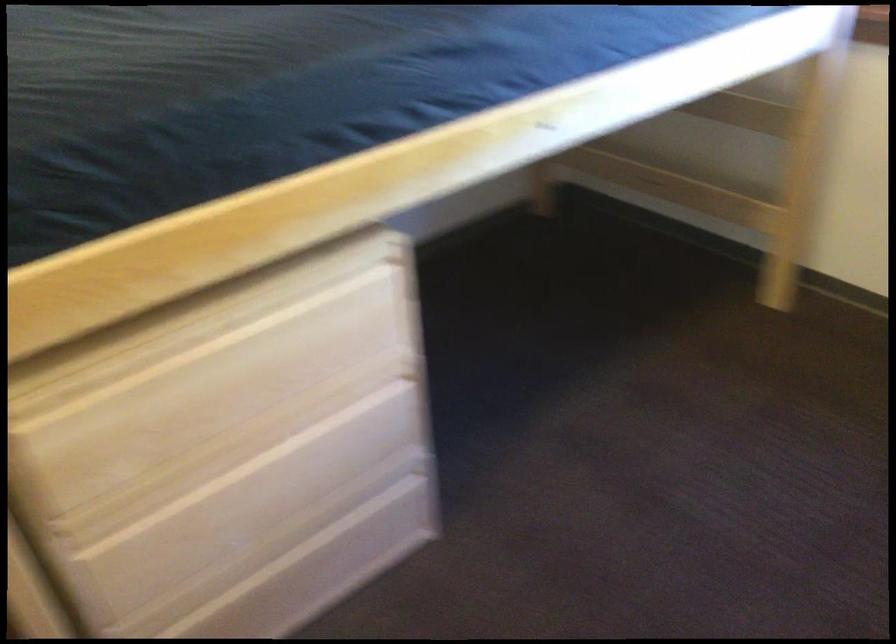
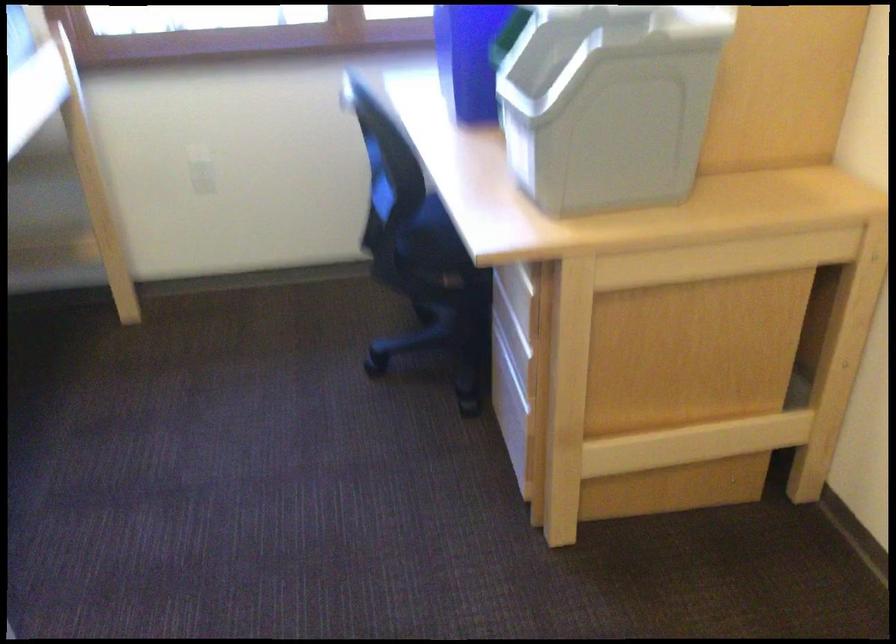
Question: How did the camera likely rotate?

Choices:
 (A) Left
 (B) Right
 (C) Up
 (D) Down

Answer: (B)